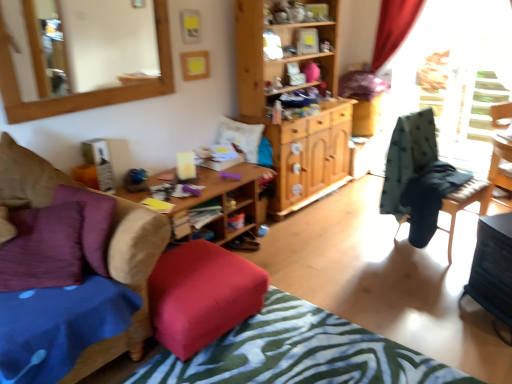
I want to click on free space that is in between black glossy table at lower right and textured green and white bedspread at lower center, so click(x=413, y=315).